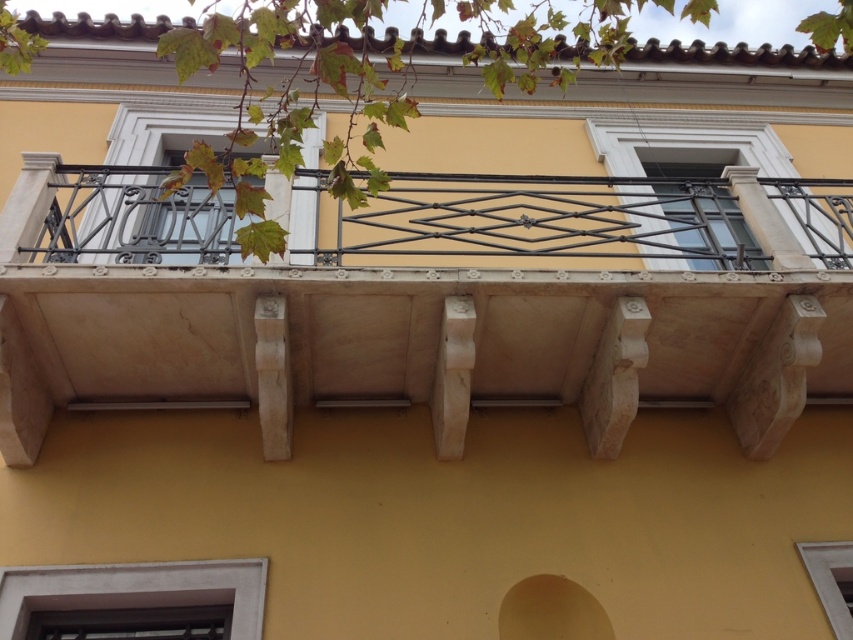
Question: Can you confirm if clear glass window at center is positioned to the left of metallic wrought iron at center?

Choices:
 (A) no
 (B) yes

Answer: (A)

Question: Can you confirm if white marble balcony at center is positioned to the left of white matte window at lower center?

Choices:
 (A) no
 (B) yes

Answer: (B)

Question: Which of the following is the farthest from the observer?

Choices:
 (A) click(51, 188)
 (B) click(732, 244)
 (C) click(807, 550)

Answer: (B)

Question: Among these objects, which one is farthest from the camera?

Choices:
 (A) metallic wrought iron at center
 (B) clear glass window at center
 (C) white marble balcony at center

Answer: (B)

Question: Does clear glass window at center have a larger size compared to metallic wrought iron at center?

Choices:
 (A) yes
 (B) no

Answer: (B)

Question: Which is farther from the white matte window at lower center?

Choices:
 (A) clear glass window at center
 (B) white marble balcony at center
 (C) metallic wrought iron at center

Answer: (C)